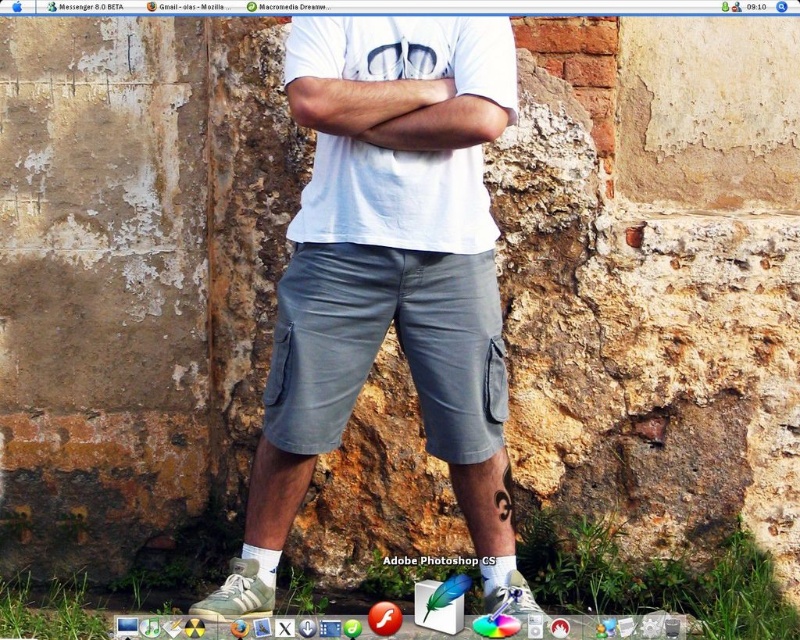
From the picture: Based on the scene description, where is the gray cotton shorts at center located in terms of coordinates?

The gray cotton shorts at center is located at coordinates point (388, 275).